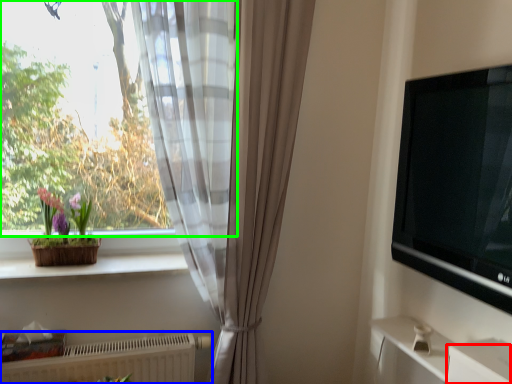
Question: Which object is the farthest from drawer (highlighted by a red box)? Choose among these: radiator (highlighted by a blue box) or window (highlighted by a green box).

Choices:
 (A) radiator
 (B) window

Answer: (B)